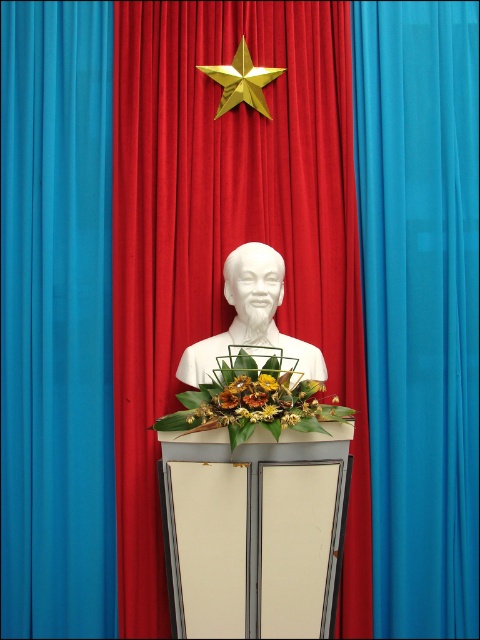
You are a GUI agent. You are given a task and a screenshot of the screen. Output one action in this format:
    pyautogui.click(x=<x>, y=<y>)
    Task: Click on the white marble bust at center
    The image size is (480, 640).
    Given the screenshot: What is the action you would take?
    pyautogui.click(x=251, y=317)

What do you see at coordinates (251, 317) in the screenshot?
I see `white marble bust at center` at bounding box center [251, 317].

I want to click on white marble bust at center, so click(x=251, y=317).

Who is more distant from viewer, (404,273) or (266,388)?

The point (404,273) is more distant.

From the picture: Is blue sheer curtain at center taller than yellow fabric flower at center?

Yes.

You are a GUI agent. You are given a task and a screenshot of the screen. Output one action in this format:
    pyautogui.click(x=<x>, y=<y>)
    Task: Click on the blue sheer curtain at center
    
    Given the screenshot: What is the action you would take?
    pyautogui.click(x=420, y=307)

Where is `blue sheer curtain at center`? blue sheer curtain at center is located at coordinates (420, 307).

This screenshot has width=480, height=640. Describe the element at coordinates (253, 538) in the screenshot. I see `white wood podium at center` at that location.

Who is more forward, (252, 595) or (261, 92)?

Positioned in front is point (252, 595).

At what (x,y) coordinates should I click in order to perform the action: click on white wood podium at center. Please return your answer as a coordinate pair (x, y). Looking at the image, I should click on (253, 538).